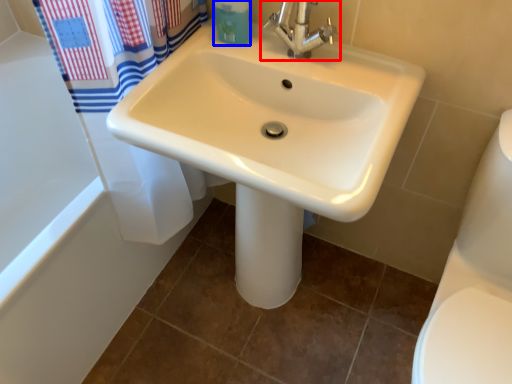
Question: Which object is further to the camera taking this photo, tap (highlighted by a red box) or toiletry (highlighted by a blue box)?

Choices:
 (A) tap
 (B) toiletry

Answer: (B)